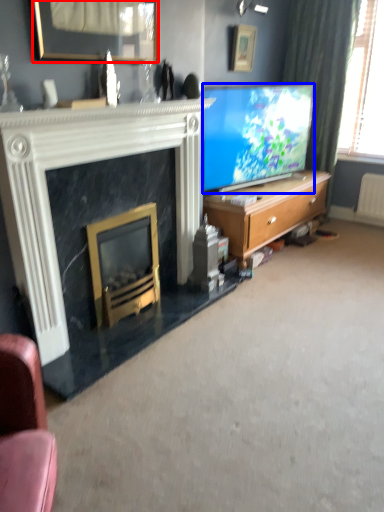
Question: Which object is further to the camera taking this photo, picture frame (highlighted by a red box) or television (highlighted by a blue box)?

Choices:
 (A) picture frame
 (B) television

Answer: (B)